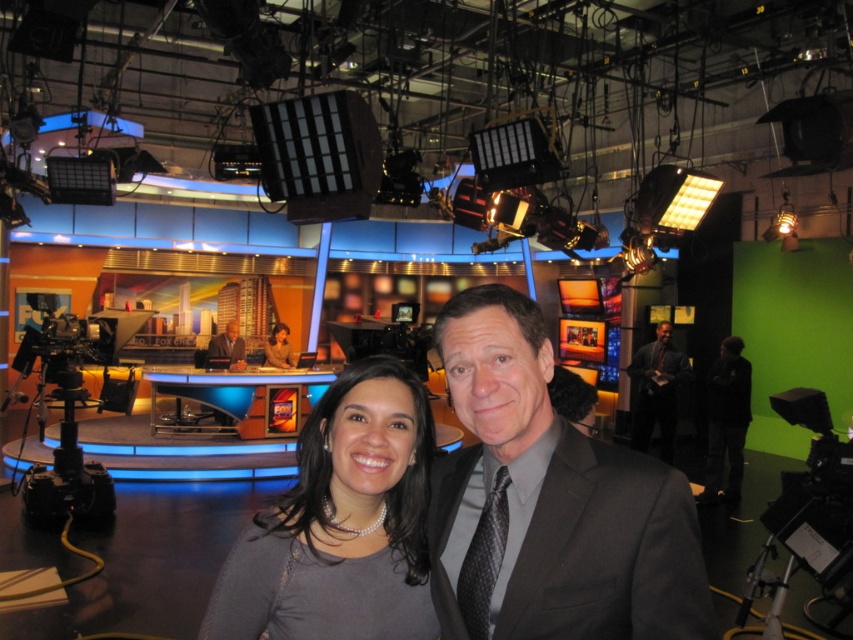
Who is positioned more to the left, black fabric at right or matte black suit at center?

matte black suit at center is more to the left.

Image resolution: width=853 pixels, height=640 pixels. What do you see at coordinates (726, 420) in the screenshot? I see `black fabric at right` at bounding box center [726, 420].

Which is behind, point (726, 353) or point (276, 362)?

Positioned behind is point (276, 362).

You are a GUI agent. You are given a task and a screenshot of the screen. Output one action in this format:
    pyautogui.click(x=<x>, y=<y>)
    Task: Click on the black fabric at right
    The height and width of the screenshot is (640, 853).
    Given the screenshot: What is the action you would take?
    pyautogui.click(x=726, y=420)

Can you confirm if gray pearl necklace at center is taller than smooth gray suit at center?

Indeed, gray pearl necklace at center has a greater height compared to smooth gray suit at center.

Between gray pearl necklace at center and smooth gray suit at center, which one appears on the left side from the viewer's perspective?

smooth gray suit at center

Where is `gray pearl necklace at center`? Image resolution: width=853 pixels, height=640 pixels. gray pearl necklace at center is located at coordinates (341, 524).

Locate an element on the screen. This screenshot has height=640, width=853. gray pearl necklace at center is located at coordinates (341, 524).

Can you confirm if dark gray suit at right is bigger than smooth gray suit at center?

Correct, dark gray suit at right is larger in size than smooth gray suit at center.

Is dark gray suit at right to the right of smooth gray suit at center from the viewer's perspective?

Indeed, dark gray suit at right is positioned on the right side of smooth gray suit at center.

Does point (666, 365) come closer to viewer compared to point (225, 346)?

Yes, point (666, 365) is in front of point (225, 346).

At what (x,y) coordinates should I click in order to perform the action: click on dark gray suit at right. Please return your answer as a coordinate pair (x, y). Looking at the image, I should click on (656, 390).